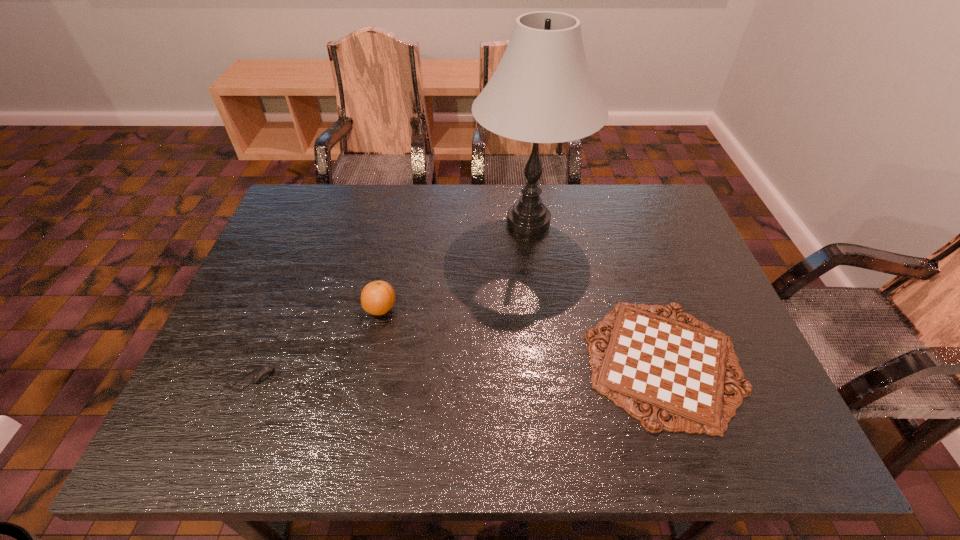
Locate an element on the screen. The width and height of the screenshot is (960, 540). free location at the far right corner is located at coordinates (652, 210).

Find the location of `free region at the near right corner of the desktop`. free region at the near right corner of the desktop is located at coordinates (758, 439).

Locate an element on the screen. vacant area that lies between the third shortest object and the chessboard is located at coordinates (522, 335).

You are a GUI agent. You are given a task and a screenshot of the screen. Output one action in this format:
    pyautogui.click(x=<x>, y=<y>)
    Task: Click on the free point between the chessboard and the orange
    This screenshot has width=960, height=540.
    Given the screenshot: What is the action you would take?
    pyautogui.click(x=522, y=335)

What are the coordinates of `free space between the chessboard and the second tallest object` in the screenshot? It's located at (522, 335).

Identify the location of vacant space that is in between the farthest object and the chessboard. (596, 292).

Locate an element on the screen. The height and width of the screenshot is (540, 960). vacant space in between the mouse and the orange is located at coordinates (317, 344).

I want to click on vacant area that lies between the orange and the chessboard, so click(522, 335).

Select which object is the third closest to the mouse. Please provide its 2D coordinates. Your answer should be formatted as a tuple, i.e. [(x, y)], where the tuple contains the x and y coordinates of a point satisfying the conditions above.

[(671, 368)]

Select which object is the third closest to the chessboard. Please provide its 2D coordinates. Your answer should be formatted as a tuple, i.e. [(x, y)], where the tuple contains the x and y coordinates of a point satisfying the conditions above.

[(263, 373)]